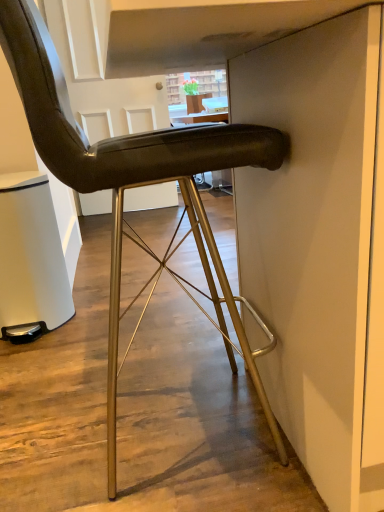
The width and height of the screenshot is (384, 512). I want to click on vacant area that is in front of white matte trash can at lower left, so click(46, 362).